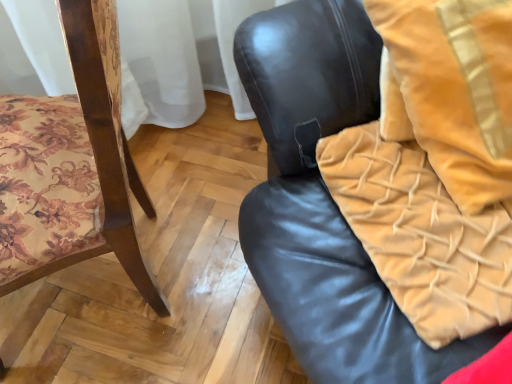
Where is `velvet yellow blanket at right`? The width and height of the screenshot is (512, 384). velvet yellow blanket at right is located at coordinates (421, 234).

Locate an element on the screen. The image size is (512, 384). wooden floral-patterned chair at left, placed as the 2th chair when sorted from right to left is located at coordinates (72, 165).

This screenshot has height=384, width=512. Describe the element at coordinates (455, 89) in the screenshot. I see `velvet gold throw pillow at upper right` at that location.

I want to click on black leather chair at center, the second chair from the left, so click(x=324, y=201).

Image resolution: width=512 pixels, height=384 pixels. In order to click on velvet yellow blanket at right in this screenshot , I will do `click(421, 234)`.

From the image's perspective, which one is positioned higher, black leather chair at center, the second chair from the left, or wooden floral-patterned chair at left, placed as the 1th chair when sorted from left to right?

black leather chair at center, the second chair from the left, appears higher in the image.

Can you confirm if black leather chair at center, the first chair positioned from the right, is wider than wooden floral-patterned chair at left, placed as the 2th chair when sorted from right to left?

In fact, black leather chair at center, the first chair positioned from the right, might be narrower than wooden floral-patterned chair at left, placed as the 2th chair when sorted from right to left.

At what (x,y) coordinates should I click in order to perform the action: click on chair in front of the wooden floral-patterned chair at left, placed as the 2th chair when sorted from right to left. Please return your answer as a coordinate pair (x, y). This screenshot has height=384, width=512. Looking at the image, I should click on (324, 201).

Which is more distant, (261,97) or (81,47)?

The point (261,97) is farther.

From a real-world perspective, is velvet gold throw pillow at upper right positioned above or below wooden floral-patterned chair at left, placed as the 2th chair when sorted from right to left?

Clearly, from a real-world perspective, velvet gold throw pillow at upper right is above wooden floral-patterned chair at left, placed as the 2th chair when sorted from right to left.

From the image's perspective, would you say velvet gold throw pillow at upper right is shown under wooden floral-patterned chair at left, placed as the 1th chair when sorted from left to right?

Incorrect, from the image's perspective, velvet gold throw pillow at upper right is higher than wooden floral-patterned chair at left, placed as the 1th chair when sorted from left to right.

Does velvet gold throw pillow at upper right have a greater width compared to wooden floral-patterned chair at left, placed as the 1th chair when sorted from left to right?

No.

Is velvet yellow blanket at right facing away from velvet gold throw pillow at upper right?

Correct, velvet yellow blanket at right is looking away from velvet gold throw pillow at upper right.

Consider the image. Is velvet yellow blanket at right behind velvet gold throw pillow at upper right?

That is True.

Based on their sizes in the image, would you say velvet yellow blanket at right is bigger or smaller than velvet gold throw pillow at upper right?

Clearly, velvet yellow blanket at right is smaller in size than velvet gold throw pillow at upper right.

Does velvet yellow blanket at right have a greater width compared to velvet gold throw pillow at upper right?

Correct, the width of velvet yellow blanket at right exceeds that of velvet gold throw pillow at upper right.

You are a GUI agent. You are given a task and a screenshot of the screen. Output one action in this format:
    pyautogui.click(x=<x>, y=<y>)
    Task: Click on the chair on the left of black leather chair at center, the first chair positioned from the right
    
    Given the screenshot: What is the action you would take?
    pyautogui.click(x=72, y=165)

Is wooden floral-patterned chair at left, placed as the 2th chair when sorted from right to left, facing away from black leather chair at center, the first chair positioned from the right?

Yes, black leather chair at center, the first chair positioned from the right, is at the back of wooden floral-patterned chair at left, placed as the 2th chair when sorted from right to left.

In the image, is wooden floral-patterned chair at left, placed as the 2th chair when sorted from right to left, positioned in front of or behind black leather chair at center, the second chair from the left?

In the image, wooden floral-patterned chair at left, placed as the 2th chair when sorted from right to left, appears behind black leather chair at center, the second chair from the left.

Which of these two, wooden floral-patterned chair at left, placed as the 1th chair when sorted from left to right, or black leather chair at center, the second chair from the left, is smaller?

black leather chair at center, the second chair from the left, is smaller.

Could you tell me if velvet yellow blanket at right is turned towards black leather chair at center, the first chair positioned from the right?

Yes, velvet yellow blanket at right is turned towards black leather chair at center, the first chair positioned from the right.

How different are the orientations of velvet yellow blanket at right and black leather chair at center, the second chair from the left, in degrees?

The facing directions of velvet yellow blanket at right and black leather chair at center, the second chair from the left, are 0.000642 degrees apart.

In the scene shown: Is velvet yellow blanket at right shorter than black leather chair at center, the second chair from the left?

Correct, velvet yellow blanket at right is not as tall as black leather chair at center, the second chair from the left.

Looking at this image, is there a large distance between velvet yellow blanket at right and black leather chair at center, the first chair positioned from the right?

No.

Can you tell me how much velvet yellow blanket at right and wooden floral-patterned chair at left, placed as the 2th chair when sorted from right to left, differ in facing direction?

5.49 degrees separate the facing orientations of velvet yellow blanket at right and wooden floral-patterned chair at left, placed as the 2th chair when sorted from right to left.

Is velvet yellow blanket at right facing away from wooden floral-patterned chair at left, placed as the 2th chair when sorted from right to left?

No, velvet yellow blanket at right's orientation is not away from wooden floral-patterned chair at left, placed as the 2th chair when sorted from right to left.

Is velvet yellow blanket at right not near wooden floral-patterned chair at left, placed as the 2th chair when sorted from right to left?

No, velvet yellow blanket at right is not far from wooden floral-patterned chair at left, placed as the 2th chair when sorted from right to left.

Based on their positions, is velvet yellow blanket at right located to the left or right of wooden floral-patterned chair at left, placed as the 1th chair when sorted from left to right?

velvet yellow blanket at right is to the right of wooden floral-patterned chair at left, placed as the 1th chair when sorted from left to right.

Based on the photo, is black leather chair at center, the first chair positioned from the right, taller or shorter than velvet yellow blanket at right?

In the image, black leather chair at center, the first chair positioned from the right, appears to be taller than velvet yellow blanket at right.

From the image's perspective, between black leather chair at center, the first chair positioned from the right, and velvet yellow blanket at right, who is located below?

velvet yellow blanket at right is shown below in the image.

From a real-world perspective, is black leather chair at center, the first chair positioned from the right, physically located above or below velvet yellow blanket at right?

black leather chair at center, the first chair positioned from the right, is below velvet yellow blanket at right.

In the scene shown: Relative to velvet yellow blanket at right, is black leather chair at center, the second chair from the left, in front or behind?

In the image, black leather chair at center, the second chair from the left, appears in front of velvet yellow blanket at right.

Identify the location of chair above the wooden floral-patterned chair at left, placed as the 1th chair when sorted from left to right (from a real-world perspective). The height and width of the screenshot is (384, 512). (324, 201).

This screenshot has height=384, width=512. Find the location of `throw pillow located on the right of wooden floral-patterned chair at left, placed as the 2th chair when sorted from right to left`. throw pillow located on the right of wooden floral-patterned chair at left, placed as the 2th chair when sorted from right to left is located at coordinates (455, 89).

Based on their spatial positions, is wooden floral-patterned chair at left, placed as the 1th chair when sorted from left to right, or velvet yellow blanket at right further from black leather chair at center, the first chair positioned from the right?

wooden floral-patterned chair at left, placed as the 1th chair when sorted from left to right, is further to black leather chair at center, the first chair positioned from the right.

Estimate the real-world distances between objects in this image. Which object is further from wooden floral-patterned chair at left, placed as the 1th chair when sorted from left to right, velvet gold throw pillow at upper right or black leather chair at center, the first chair positioned from the right?

The object further to wooden floral-patterned chair at left, placed as the 1th chair when sorted from left to right, is velvet gold throw pillow at upper right.

Based on their spatial positions, is velvet yellow blanket at right or velvet gold throw pillow at upper right further from wooden floral-patterned chair at left, placed as the 1th chair when sorted from left to right?

The object further to wooden floral-patterned chair at left, placed as the 1th chair when sorted from left to right, is velvet gold throw pillow at upper right.

Based on their spatial positions, is wooden floral-patterned chair at left, placed as the 2th chair when sorted from right to left, or velvet gold throw pillow at upper right closer to velvet yellow blanket at right?

Based on the image, velvet gold throw pillow at upper right appears to be nearer to velvet yellow blanket at right.

Looking at the image, which one is located further to velvet yellow blanket at right, black leather chair at center, the second chair from the left, or velvet gold throw pillow at upper right?

Among the two, velvet gold throw pillow at upper right is located further to velvet yellow blanket at right.

Considering their positions, is velvet yellow blanket at right positioned closer to wooden floral-patterned chair at left, placed as the 2th chair when sorted from right to left, than black leather chair at center, the second chair from the left?

black leather chair at center, the second chair from the left, is closer to wooden floral-patterned chair at left, placed as the 2th chair when sorted from right to left.

Based on their spatial positions, is wooden floral-patterned chair at left, placed as the 1th chair when sorted from left to right, or velvet yellow blanket at right closer to velvet gold throw pillow at upper right?

velvet yellow blanket at right.

Based on the photo, based on their spatial positions, is velvet gold throw pillow at upper right or velvet yellow blanket at right closer to black leather chair at center, the first chair positioned from the right?

The object closer to black leather chair at center, the first chair positioned from the right, is velvet yellow blanket at right.

Where is `blanket between wooden floral-patterned chair at left, placed as the 1th chair when sorted from left to right, and velvet gold throw pillow at upper right`? The width and height of the screenshot is (512, 384). blanket between wooden floral-patterned chair at left, placed as the 1th chair when sorted from left to right, and velvet gold throw pillow at upper right is located at coordinates (421, 234).

Where is `chair between wooden floral-patterned chair at left, placed as the 2th chair when sorted from right to left, and velvet gold throw pillow at upper right from left to right`? chair between wooden floral-patterned chair at left, placed as the 2th chair when sorted from right to left, and velvet gold throw pillow at upper right from left to right is located at coordinates (324, 201).

Locate an element on the screen. This screenshot has height=384, width=512. throw pillow between black leather chair at center, the first chair positioned from the right, and velvet yellow blanket at right, along the z-axis is located at coordinates (455, 89).

Where is `chair between wooden floral-patterned chair at left, placed as the 2th chair when sorted from right to left, and velvet yellow blanket at right, in the horizontal direction`? The image size is (512, 384). chair between wooden floral-patterned chair at left, placed as the 2th chair when sorted from right to left, and velvet yellow blanket at right, in the horizontal direction is located at coordinates (324, 201).